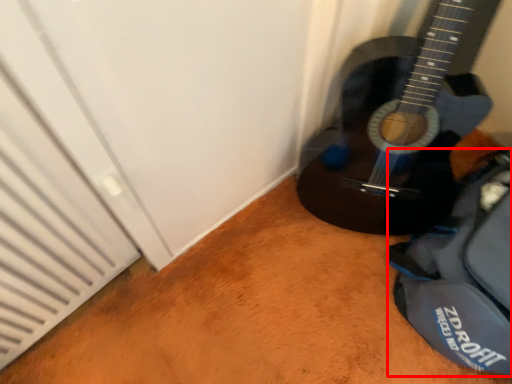
Question: From the image, what is the correct spatial relationship of messenger bag (annotated by the red box) in relation to guitar?

Choices:
 (A) left
 (B) right

Answer: (B)